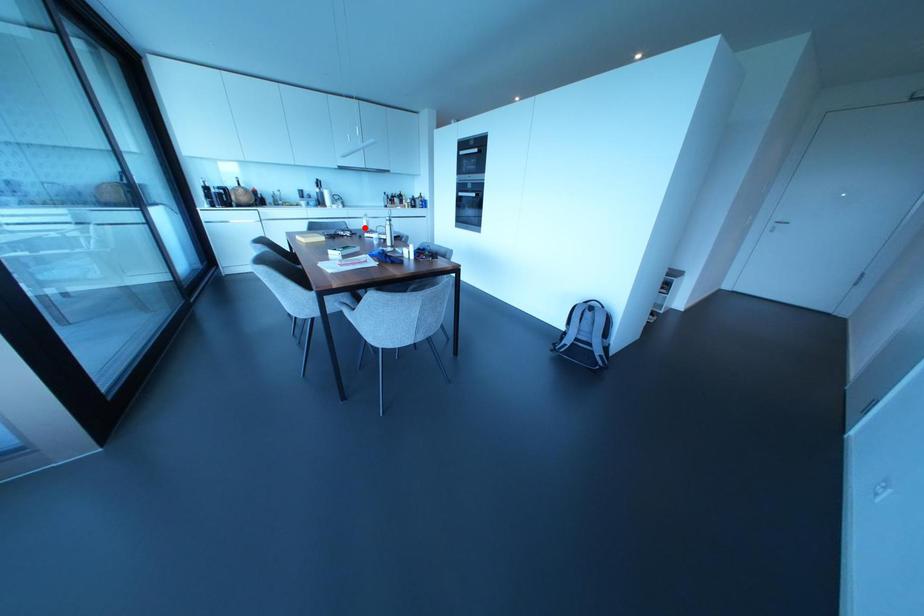
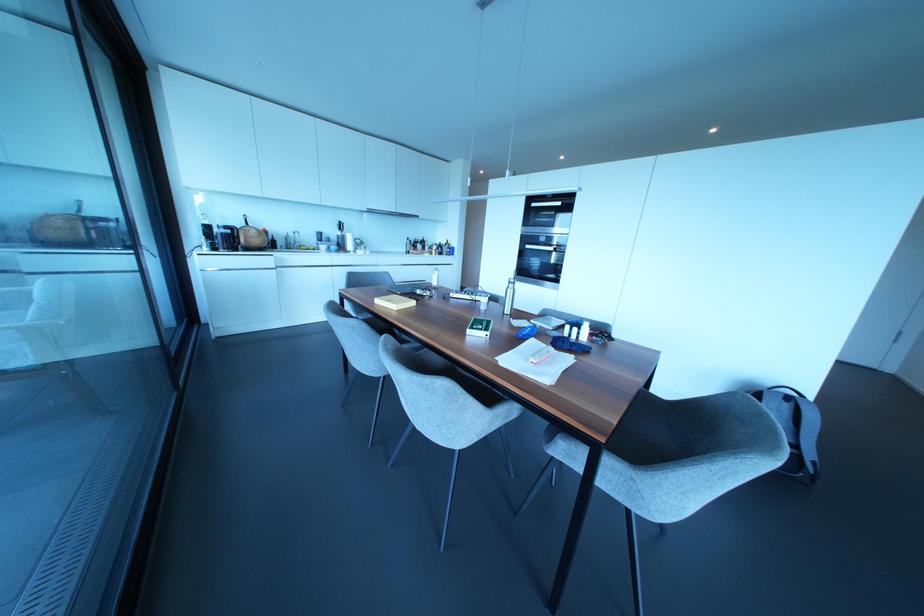
The point at the highlighted location is marked in the first image. Where is the corresponding point in the second image?

(434, 283)